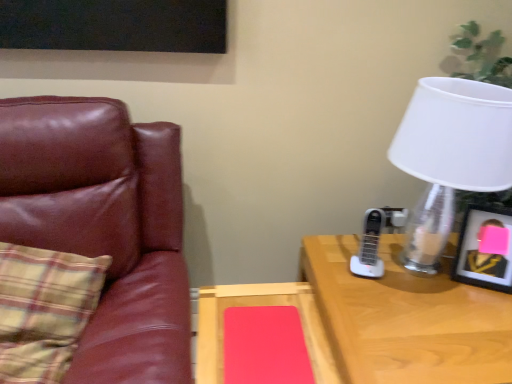
Question: Is plaid fabric pillow at left further to camera compared to leather couch at left?

Choices:
 (A) no
 (B) yes

Answer: (B)

Question: From a real-world perspective, is plaid fabric pillow at left physically below leather couch at left?

Choices:
 (A) no
 (B) yes

Answer: (A)

Question: Is plaid fabric pillow at left positioned far away from leather couch at left?

Choices:
 (A) no
 (B) yes

Answer: (A)

Question: Is plaid fabric pillow at left bigger than leather couch at left?

Choices:
 (A) no
 (B) yes

Answer: (A)

Question: Can you confirm if plaid fabric pillow at left is smaller than leather couch at left?

Choices:
 (A) no
 (B) yes

Answer: (B)

Question: Can you see plaid fabric pillow at left touching leather couch at left?

Choices:
 (A) yes
 (B) no

Answer: (B)

Question: From a real-world perspective, is matte wood table at center positioned over plaid fabric pillow at left based on gravity?

Choices:
 (A) no
 (B) yes

Answer: (A)

Question: Is matte wood table at center smaller than plaid fabric pillow at left?

Choices:
 (A) no
 (B) yes

Answer: (B)

Question: Can you confirm if matte wood table at center is thinner than plaid fabric pillow at left?

Choices:
 (A) yes
 (B) no

Answer: (A)

Question: Is matte wood table at center positioned far away from plaid fabric pillow at left?

Choices:
 (A) yes
 (B) no

Answer: (B)

Question: Is matte wood table at center closer to the viewer compared to plaid fabric pillow at left?

Choices:
 (A) no
 (B) yes

Answer: (A)

Question: Is matte wood table at center placed right next to plaid fabric pillow at left?

Choices:
 (A) no
 (B) yes

Answer: (A)

Question: From the image's perspective, is white matte lampshade at upper right located beneath plaid fabric pillow at left?

Choices:
 (A) yes
 (B) no

Answer: (B)